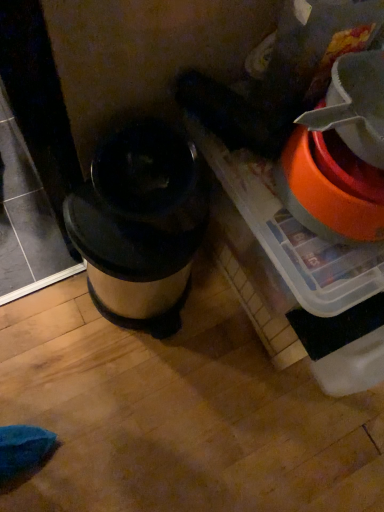
Measure the distance between metallic silver trash can at center and camera.

metallic silver trash can at center and camera are 28.63 inches apart from each other.

This screenshot has width=384, height=512. Describe the element at coordinates (140, 225) in the screenshot. I see `metallic silver trash can at center` at that location.

Locate an element on the screen. This screenshot has height=512, width=384. metallic silver trash can at center is located at coordinates (140, 225).

You are a GUI agent. You are given a task and a screenshot of the screen. Output one action in this format:
    pyautogui.click(x=<x>, y=<y>)
    Task: Click on the orange plastic bucket at right
    The width and height of the screenshot is (384, 512).
    Given the screenshot: What is the action you would take?
    pyautogui.click(x=340, y=157)

What do you see at coordinates (340, 157) in the screenshot? This screenshot has height=512, width=384. I see `orange plastic bucket at right` at bounding box center [340, 157].

This screenshot has height=512, width=384. In order to click on metallic silver trash can at center in this screenshot , I will do `click(140, 225)`.

Is orange plastic bucket at right at the left side of metallic silver trash can at center?

Incorrect, orange plastic bucket at right is not on the left side of metallic silver trash can at center.

Which is in front, orange plastic bucket at right or metallic silver trash can at center?

orange plastic bucket at right.

Is point (376, 73) behind point (157, 136)?

That is False.

From the image's perspective, which one is positioned higher, orange plastic bucket at right or metallic silver trash can at center?

orange plastic bucket at right appears higher in the image.

From a real-world perspective, which is physically below, orange plastic bucket at right or metallic silver trash can at center?

From a 3D spatial view, metallic silver trash can at center is below.

Which object is wider, orange plastic bucket at right or metallic silver trash can at center?

With larger width is metallic silver trash can at center.

From their relative heights in the image, would you say orange plastic bucket at right is taller or shorter than metallic silver trash can at center?

Clearly, orange plastic bucket at right is shorter compared to metallic silver trash can at center.

Is orange plastic bucket at right bigger or smaller than metallic silver trash can at center?

In the image, orange plastic bucket at right appears to be smaller than metallic silver trash can at center.

Looking at this image, which is correct: orange plastic bucket at right is inside metallic silver trash can at center, or outside of it?

orange plastic bucket at right lies outside metallic silver trash can at center.

Are orange plastic bucket at right and metallic silver trash can at center beside each other?

They are not placed beside each other.

Is metallic silver trash can at center at the back of orange plastic bucket at right?

No, orange plastic bucket at right is not facing away from metallic silver trash can at center.

How different are the orientations of orange plastic bucket at right and metallic silver trash can at center in degrees?

They differ by 0.000739 degrees in their facing directions.

Where is `waste container below the orange plastic bucket at right (from the image's perspective)`? waste container below the orange plastic bucket at right (from the image's perspective) is located at coordinates (140, 225).

Considering the positions of objects metallic silver trash can at center and orange plastic bucket at right in the image provided, who is more to the left, metallic silver trash can at center or orange plastic bucket at right?

metallic silver trash can at center.

Between metallic silver trash can at center and orange plastic bucket at right, which one is positioned behind?

metallic silver trash can at center is further away from the camera.

Is point (101, 264) more distant than point (279, 165)?

Yes, it is behind point (279, 165).

From the image's perspective, between metallic silver trash can at center and orange plastic bucket at right, who is located below?

From the image's view, metallic silver trash can at center is below.

From a real-world perspective, which object stands above the other?

orange plastic bucket at right, from a real-world perspective.

Considering the sizes of metallic silver trash can at center and orange plastic bucket at right in the image, is metallic silver trash can at center wider or thinner than orange plastic bucket at right?

Considering their sizes, metallic silver trash can at center looks broader than orange plastic bucket at right.

Looking at this image, is metallic silver trash can at center taller or shorter than orange plastic bucket at right?

In the image, metallic silver trash can at center appears to be taller than orange plastic bucket at right.

Who is bigger, metallic silver trash can at center or orange plastic bucket at right?

With larger size is metallic silver trash can at center.

Can we say metallic silver trash can at center lies outside orange plastic bucket at right?

Yes, metallic silver trash can at center is not within orange plastic bucket at right.

Is the surface of metallic silver trash can at center in direct contact with orange plastic bucket at right?

No, metallic silver trash can at center is not touching orange plastic bucket at right.

Could you tell me if metallic silver trash can at center is turned towards orange plastic bucket at right?

No, metallic silver trash can at center is not aimed at orange plastic bucket at right.

How different are the orientations of metallic silver trash can at center and orange plastic bucket at right in degrees?

metallic silver trash can at center and orange plastic bucket at right are facing 0.000739 degrees away from each other.

Measure the distance between metallic silver trash can at center and orange plastic bucket at right.

metallic silver trash can at center is 11.69 inches from orange plastic bucket at right.

This screenshot has height=512, width=384. What are the coordinates of `appliance above the metallic silver trash can at center (from a real-world perspective)` in the screenshot? It's located at (340, 157).

I want to click on appliance above the metallic silver trash can at center (from the image's perspective), so click(x=340, y=157).

Locate an element on the screen. waste container behind the orange plastic bucket at right is located at coordinates (140, 225).